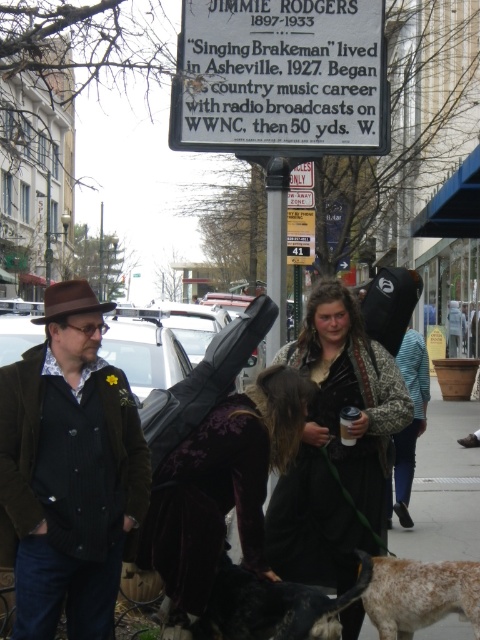
Can you confirm if brown felt hat at center is bigger than speckled fur dog at lower right?

Indeed, brown felt hat at center has a larger size compared to speckled fur dog at lower right.

Can you confirm if brown felt hat at center is wider than speckled fur dog at lower right?

Yes, brown felt hat at center is wider than speckled fur dog at lower right.

The image size is (480, 640). I want to click on brown felt hat at center, so click(x=70, y=468).

Does camouflage jacket at center come in front of black fur dog at lower center?

No, camouflage jacket at center is behind black fur dog at lower center.

From the picture: Which of these two, camouflage jacket at center or black fur dog at lower center, stands shorter?

black fur dog at lower center is shorter.

You are a GUI agent. You are given a task and a screenshot of the screen. Output one action in this format:
    pyautogui.click(x=<x>, y=<y>)
    Task: Click on the camouflage jacket at center
    
    Given the screenshot: What is the action you would take?
    pyautogui.click(x=336, y=445)

In order to click on camouflage jacket at center in this screenshot , I will do `click(336, 445)`.

Identify the location of brown felt hat at center. This screenshot has height=640, width=480. (70, 468).

Consider the image. Does brown felt hat at center have a larger size compared to camouflage jacket at center?

Incorrect, brown felt hat at center is not larger than camouflage jacket at center.

This screenshot has height=640, width=480. Identify the location of brown felt hat at center. (x=70, y=468).